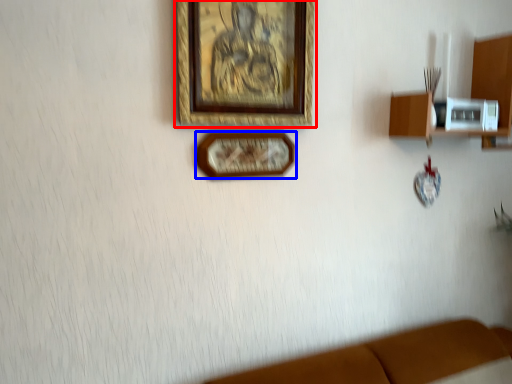
Question: Among these objects, which one is nearest to the camera, picture frame (highlighted by a red box) or picture frame (highlighted by a blue box)?

Choices:
 (A) picture frame
 (B) picture frame

Answer: (A)